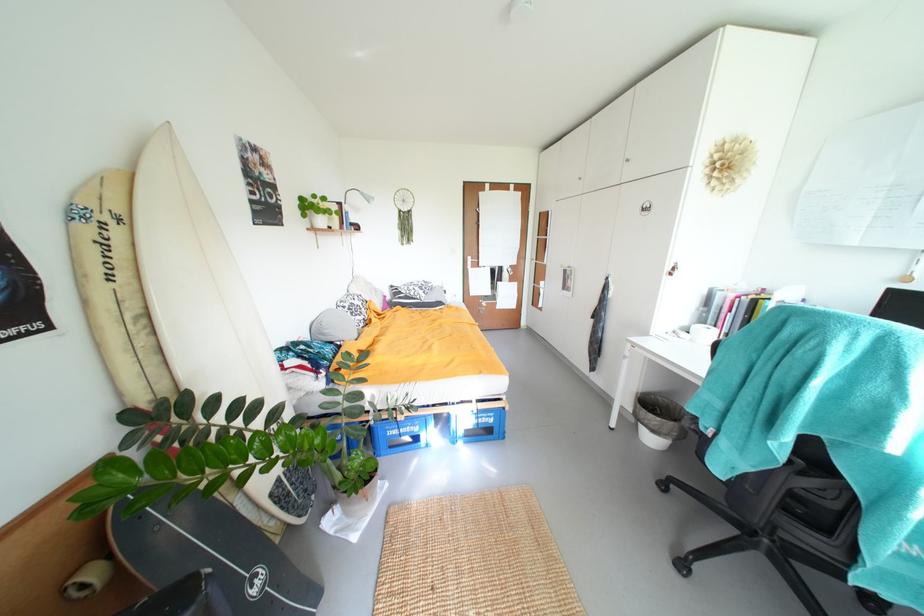
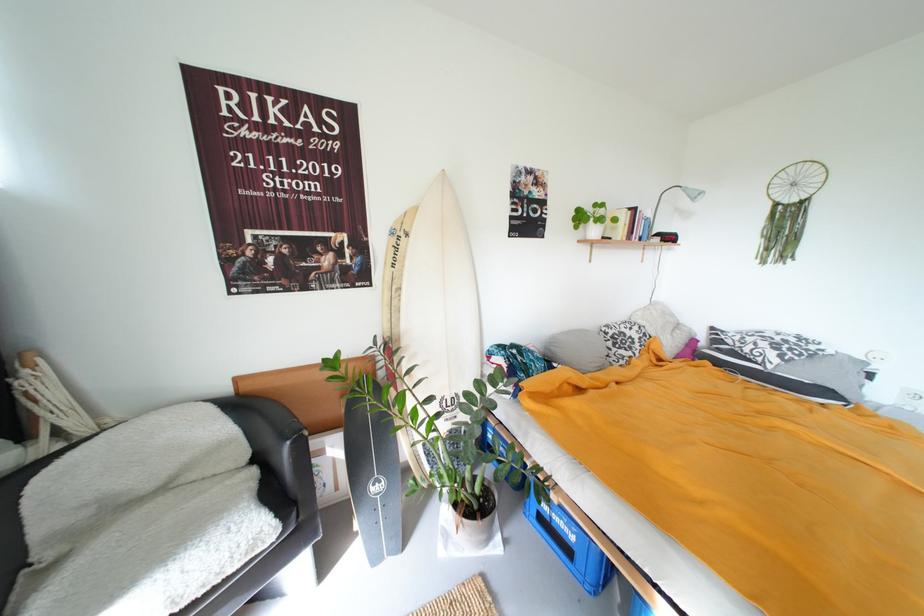
Find the pixel in the second image that matches (x=365, y=229) in the first image.

(677, 240)